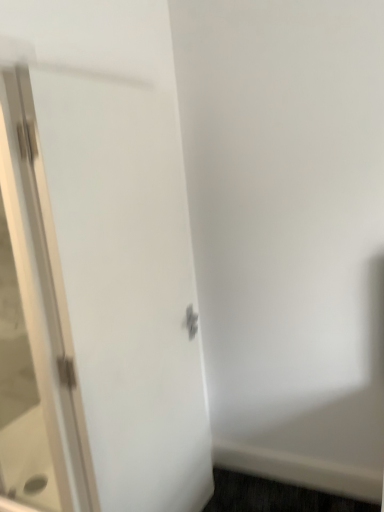
What do you see at coordinates (97, 268) in the screenshot? I see `white matte door at center` at bounding box center [97, 268].

Image resolution: width=384 pixels, height=512 pixels. In order to click on white matte door at center in this screenshot , I will do `click(97, 268)`.

Identify the location of white matte door at center. (97, 268).